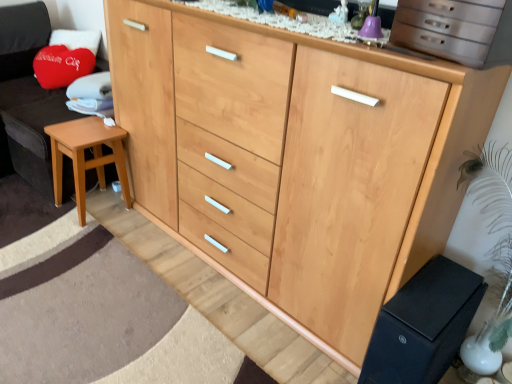
Question: From a real-world perspective, is light brown wood stool at lower left physically below wooden stool at left?

Choices:
 (A) yes
 (B) no

Answer: (A)

Question: Considering the relative positions of light brown wood stool at lower left and wooden stool at left in the image provided, is light brown wood stool at lower left behind wooden stool at left?

Choices:
 (A) yes
 (B) no

Answer: (A)

Question: Does light brown wood stool at lower left come in front of wooden stool at left?

Choices:
 (A) yes
 (B) no

Answer: (B)

Question: Is wooden stool at left inside light brown wood stool at lower left?

Choices:
 (A) yes
 (B) no

Answer: (B)

Question: Considering the relative sizes of light brown wood stool at lower left and wooden stool at left in the image provided, is light brown wood stool at lower left shorter than wooden stool at left?

Choices:
 (A) no
 (B) yes

Answer: (B)

Question: Is light brown wood stool at lower left positioned beyond the bounds of wooden stool at left?

Choices:
 (A) no
 (B) yes

Answer: (B)

Question: Is the depth of wooden stool at left less than that of light brown wood stool at lower left?

Choices:
 (A) yes
 (B) no

Answer: (A)

Question: From the image's perspective, is wooden stool at left on light brown wood stool at lower left?

Choices:
 (A) yes
 (B) no

Answer: (A)

Question: Does wooden stool at left appear on the left side of light brown wood stool at lower left?

Choices:
 (A) yes
 (B) no

Answer: (A)

Question: Is light brown wood stool at lower left surrounded by wooden stool at left?

Choices:
 (A) yes
 (B) no

Answer: (B)

Question: Is wooden stool at left wider than light brown wood stool at lower left?

Choices:
 (A) yes
 (B) no

Answer: (A)

Question: Is wooden stool at left smaller than light brown wood stool at lower left?

Choices:
 (A) no
 (B) yes

Answer: (A)

Question: From a real-world perspective, is light brown wood stool at lower left below black matte changing table at lower right?

Choices:
 (A) yes
 (B) no

Answer: (B)